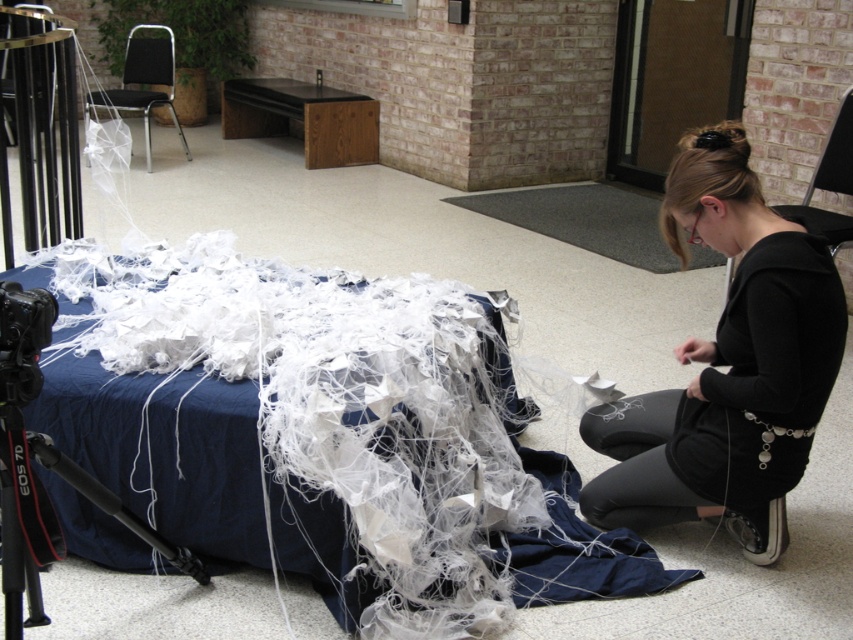
Question: Among these objects, which one is nearest to the camera?

Choices:
 (A) black fabric at lower right
 (B) black plastic chair at upper right

Answer: (A)

Question: Is black fabric at lower right closer to the viewer compared to black plastic chair at upper left?

Choices:
 (A) yes
 (B) no

Answer: (A)

Question: Can you confirm if black metal tripod at lower left is wider than black plastic chair at upper right?

Choices:
 (A) no
 (B) yes

Answer: (A)

Question: Which point appears farthest from the camera in this image?

Choices:
 (A) (196, 566)
 (B) (90, 92)
 (C) (664, 193)

Answer: (B)

Question: Can you confirm if black fabric at lower right is wider than black plastic chair at upper left?

Choices:
 (A) yes
 (B) no

Answer: (B)

Question: Estimate the real-world distances between objects in this image. Which object is farther from the metallic silver chair at upper left?

Choices:
 (A) black plastic chair at upper left
 (B) black metal tripod at lower left
 (C) black fabric at lower right
 (D) black plastic chair at upper right

Answer: (D)